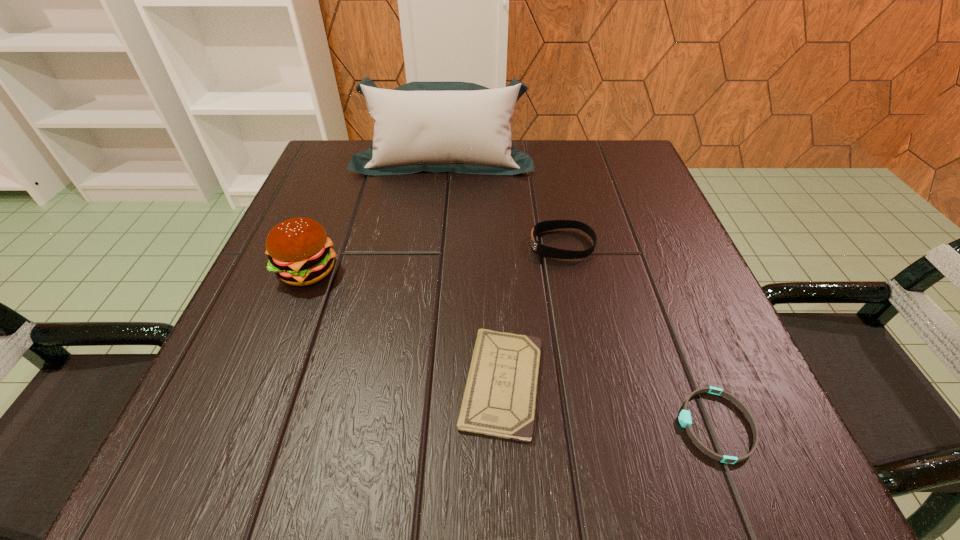
Where is `cushion`? The image size is (960, 540). cushion is located at coordinates (460, 127).

You are a GUI agent. You are given a task and a screenshot of the screen. Output one action in this format:
    pyautogui.click(x=<x>, y=<y>)
    Task: Click on the farthest object
    This screenshot has height=540, width=960.
    Given the screenshot: What is the action you would take?
    pyautogui.click(x=460, y=127)

Locate an element on the screen. Image resolution: width=960 pixels, height=540 pixels. hamburger is located at coordinates click(299, 250).

Identify the location of the taller wristband. (550, 252).

Where is `the farther wristband`? Image resolution: width=960 pixels, height=540 pixels. the farther wristband is located at coordinates (550, 252).

Find the location of `checkbook`. checkbook is located at coordinates (499, 400).

At what (x,y) coordinates should I click in order to perform the action: click on the shorter wristband. Please return your answer as a coordinate pair (x, y). Image resolution: width=960 pixels, height=540 pixels. Looking at the image, I should click on (685, 420).

Where is `the right wristband`? This screenshot has height=540, width=960. the right wristband is located at coordinates (685, 420).

Where is `free space located on the surface of the cushion`? This screenshot has width=960, height=540. free space located on the surface of the cushion is located at coordinates (436, 221).

Find the location of `free spot located on the back of the hamburger`. free spot located on the back of the hamburger is located at coordinates (346, 175).